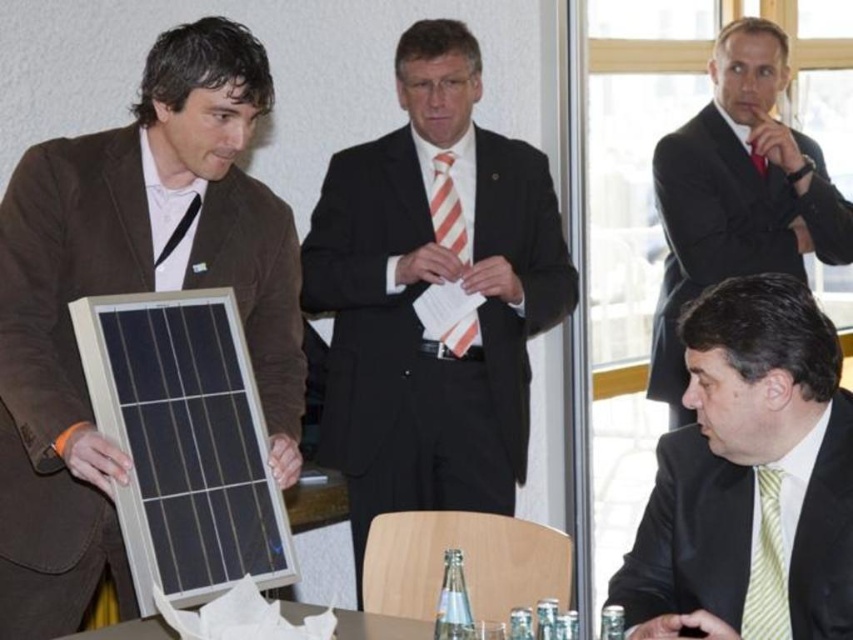
You are a photographer standing 2 meters away from the yellow striped tie at lower right. You want to take a photo of the camera. Is the camera within your reach to focus on it without moving? Please consider the distance between them.

The yellow striped tie at lower right and camera are 1.85 meters apart. Since you are 2 meters away from the yellow striped tie at lower right, the camera is 1.85 meters away from the tie, so the total distance from you to the camera would be approximately 3.85 meters. Most cameras can focus at that distance, so yes, the camera can be focused on without moving closer.

You are a photographer at the back of the room. You need to take a photo of the matte black solar panel at left and the white striped tie at center. Which object should you adjust your camera focus to first to ensure both are in frame?

The matte black solar panel at left is to the left of white striped tie at center, so you should focus on the matte black solar panel at left first to ensure both are in frame.

You are an interior designer planning to place the matte black solar panel at left and the black matte suit at center in a room. Based on their positions in the image, which object should be placed lower to maintain the spatial relationship shown?

The matte black solar panel at left should be placed lower than the black matte suit at center because it is positioned under it in the image.